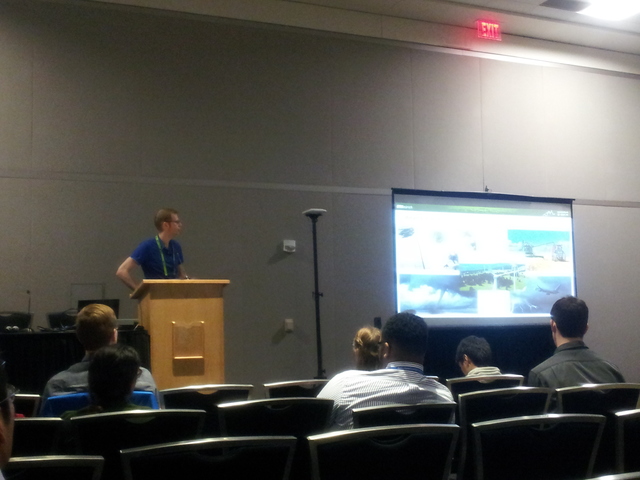
At what (x,y) coordinates should I click in order to perform the action: click on ceiling light. Please return your answer as a coordinate pair (x, y). The height and width of the screenshot is (480, 640). Looking at the image, I should click on (589, 15).